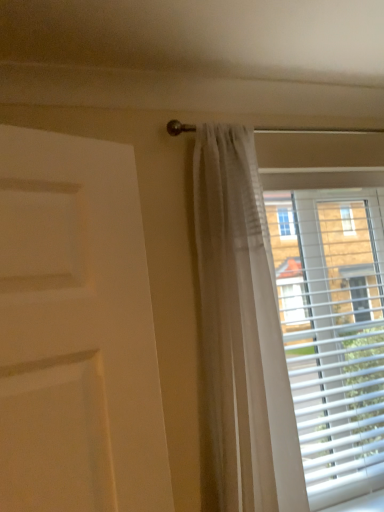
Question: Should I look upward or downward to see sheer white curtain at upper center?

Choices:
 (A) up
 (B) down

Answer: (B)